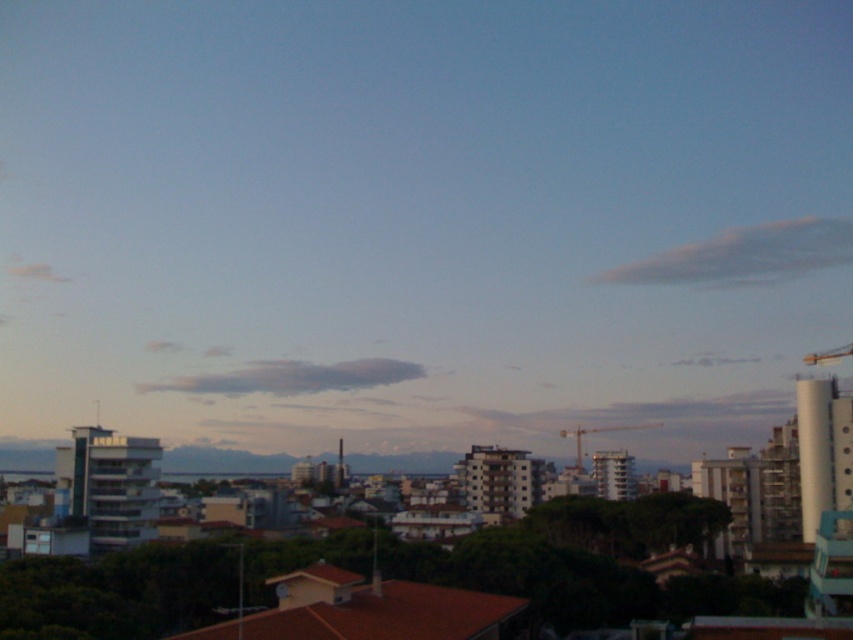
You are an urban planner reviewing this cityscape. You need to determine the exact position of the metallic construction crane at center for a zoning report. What are its coordinates?

The metallic construction crane at center is located at coordinates point (598, 433).